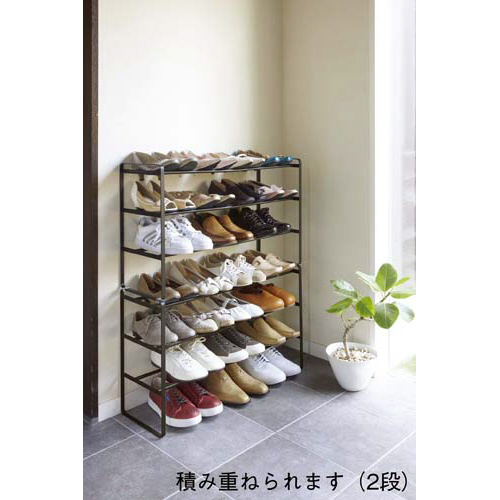
The image size is (500, 500). In order to click on show rack shelves in this screenshot , I will do `click(133, 419)`, `click(137, 379)`, `click(143, 344)`, `click(138, 301)`, `click(143, 253)`, `click(141, 213)`, `click(145, 169)`.